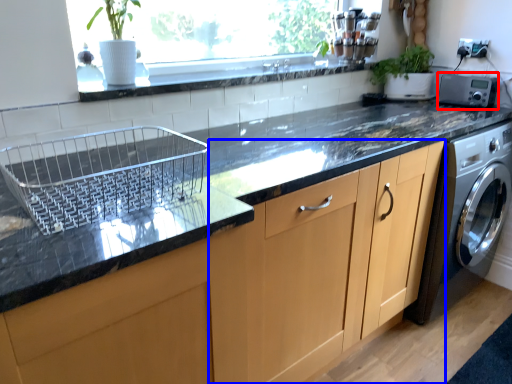
Question: Which object appears farthest to the camera in this image, appliance (highlighted by a red box) or cabinetry (highlighted by a blue box)?

Choices:
 (A) appliance
 (B) cabinetry

Answer: (A)